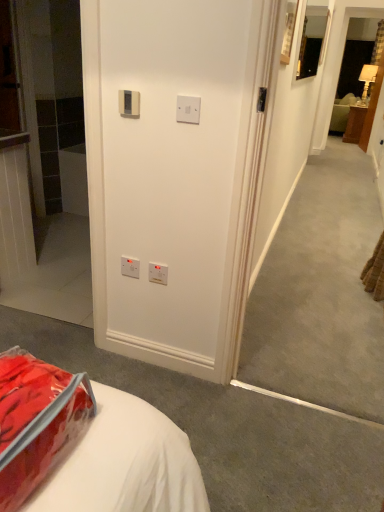
You are a GUI agent. You are given a task and a screenshot of the screen. Output one action in this format:
    pyautogui.click(x=<x>, y=<y>)
    Task: Click on the beige plastic thermostat at upper center, the second electric outlet when ordered from front to back
    
    Given the screenshot: What is the action you would take?
    pyautogui.click(x=129, y=103)

Where is `white plastic electric outlet at center, which appears as the 2th electric outlet when viewed from the right`? white plastic electric outlet at center, which appears as the 2th electric outlet when viewed from the right is located at coordinates click(x=158, y=273).

This screenshot has height=512, width=384. In order to click on wooden nightstand at right in this screenshot , I will do `click(355, 123)`.

What do you see at coordinates (188, 109) in the screenshot?
I see `white plastic switch at upper center, which is the 1th electric outlet from right to left` at bounding box center [188, 109].

Identify the location of beige plastic thermostat at upper center, the third electric outlet when ordered from back to front. (129, 103).

Can you confirm if white plastic electric outlet at lower center, marked as the third electric outlet in a top-to-bottom arrangement, is shorter than white plastic switch at upper center, which is counted as the third electric outlet, starting from the bottom?

No.

Is point (133, 269) closer or farther from the camera than point (182, 96)?

Point (133, 269) is positioned farther from the camera compared to point (182, 96).

Would you say white plastic electric outlet at lower center, acting as the 1th electric outlet starting from the left, is to the left or to the right of white plastic switch at upper center, which ranks as the 4th electric outlet in back-to-front order, in the picture?

Clearly, white plastic electric outlet at lower center, acting as the 1th electric outlet starting from the left, is on the left of white plastic switch at upper center, which ranks as the 4th electric outlet in back-to-front order, in the image.

Does white plastic electric outlet at lower center, marked as the third electric outlet in a top-to-bottom arrangement, contain white plastic switch at upper center, which ranks as the 4th electric outlet in back-to-front order?

That's incorrect, white plastic switch at upper center, which ranks as the 4th electric outlet in back-to-front order, is not inside white plastic electric outlet at lower center, marked as the third electric outlet in a top-to-bottom arrangement.

Looking at this image, from the image's perspective, does white plastic electric outlet at lower center, marked as the third electric outlet in a top-to-bottom arrangement, appear lower than beige plastic thermostat at upper center, which is the 1th electric outlet from top to bottom?

Correct, white plastic electric outlet at lower center, marked as the third electric outlet in a top-to-bottom arrangement, appears lower than beige plastic thermostat at upper center, which is the 1th electric outlet from top to bottom, in the image.

In the scene shown: Is white plastic electric outlet at lower center, the 4th electric outlet in the front-to-back sequence, taller than beige plastic thermostat at upper center, the third electric outlet when ordered from back to front?

Yes.

Looking at this image, can you confirm if white plastic electric outlet at lower center, the 4th electric outlet in the front-to-back sequence, is bigger than beige plastic thermostat at upper center, the second electric outlet when ordered from front to back?

No, white plastic electric outlet at lower center, the 4th electric outlet in the front-to-back sequence, is not bigger than beige plastic thermostat at upper center, the second electric outlet when ordered from front to back.

Could you tell me if white plastic electric outlet at lower center, marked as the third electric outlet in a top-to-bottom arrangement, is turned towards beige plastic thermostat at upper center, the third electric outlet when ordered from back to front?

No, white plastic electric outlet at lower center, marked as the third electric outlet in a top-to-bottom arrangement, is not turned towards beige plastic thermostat at upper center, the third electric outlet when ordered from back to front.

Could you tell me if matte black mirror at upper right is turned towards white plastic electric outlet at lower center, which is the fourth electric outlet from right to left?

No, matte black mirror at upper right is not aimed at white plastic electric outlet at lower center, which is the fourth electric outlet from right to left.

From the image's perspective, which one is positioned higher, matte black mirror at upper right or white plastic electric outlet at lower center, which is the fourth electric outlet from right to left?

matte black mirror at upper right is shown above in the image.

Is matte black mirror at upper right wider or thinner than white plastic electric outlet at lower center, which is the fourth electric outlet from right to left?

Considering their sizes, matte black mirror at upper right looks broader than white plastic electric outlet at lower center, which is the fourth electric outlet from right to left.

Is white plastic electric outlet at center, arranged as the fourth electric outlet when viewed from the top, thinner than translucent plastic bag at lower left?

Indeed, white plastic electric outlet at center, arranged as the fourth electric outlet when viewed from the top, has a lesser width compared to translucent plastic bag at lower left.

You are a GUI agent. You are given a task and a screenshot of the screen. Output one action in this format:
    pyautogui.click(x=<x>, y=<y>)
    Task: Click on the electric outlet that is the 2nd object directly below the translucent plastic bag at lower left (from a real-world perspective)
    This screenshot has height=512, width=384.
    Given the screenshot: What is the action you would take?
    pyautogui.click(x=158, y=273)

From the image's perspective, relative to translucent plastic bag at lower left, is white plastic electric outlet at center, which is the 1th electric outlet from bottom to top, above or below?

From the image's perspective, white plastic electric outlet at center, which is the 1th electric outlet from bottom to top, appears above translucent plastic bag at lower left.

Is white plastic electric outlet at center, arranged as the fourth electric outlet when viewed from the top, aimed at translucent plastic bag at lower left?

Yes, white plastic electric outlet at center, arranged as the fourth electric outlet when viewed from the top, is oriented towards translucent plastic bag at lower left.

From the image's perspective, is white plastic switch at upper center, which is the 1th electric outlet from right to left, located above or below wooden nightstand at right?

white plastic switch at upper center, which is the 1th electric outlet from right to left, is situated lower than wooden nightstand at right in the image.

Considering the sizes of objects white plastic switch at upper center, which ranks as the 4th electric outlet in back-to-front order, and wooden nightstand at right in the image provided, who is shorter, white plastic switch at upper center, which ranks as the 4th electric outlet in back-to-front order, or wooden nightstand at right?

white plastic switch at upper center, which ranks as the 4th electric outlet in back-to-front order.

Considering the relative positions of white plastic switch at upper center, which is counted as the third electric outlet, starting from the bottom, and wooden nightstand at right in the image provided, is white plastic switch at upper center, which is counted as the third electric outlet, starting from the bottom, to the right of wooden nightstand at right from the viewer's perspective?

In fact, white plastic switch at upper center, which is counted as the third electric outlet, starting from the bottom, is to the left of wooden nightstand at right.

Is white plastic switch at upper center, which is the 1th electric outlet from right to left, bigger or smaller than wooden nightstand at right?

Result: Clearly, white plastic switch at upper center, which is the 1th electric outlet from right to left, is smaller in size than wooden nightstand at right.

Considering the relative positions of white plastic electric outlet at center, arranged as the second electric outlet when viewed from the back, and matte black mirror at upper right in the image provided, is white plastic electric outlet at center, arranged as the second electric outlet when viewed from the back, to the left of matte black mirror at upper right from the viewer's perspective?

Yes, white plastic electric outlet at center, arranged as the second electric outlet when viewed from the back, is to the left of matte black mirror at upper right.

Based on the photo, does white plastic electric outlet at center, which appears as the 2th electric outlet when viewed from the right, have a greater height compared to matte black mirror at upper right?

In fact, white plastic electric outlet at center, which appears as the 2th electric outlet when viewed from the right, may be shorter than matte black mirror at upper right.

Locate an element on the screen. picture frame above the white plastic electric outlet at center, arranged as the fourth electric outlet when viewed from the top (from the image's perspective) is located at coordinates (312, 38).

In the scene shown: Between white plastic electric outlet at center, arranged as the fourth electric outlet when viewed from the top, and matte black mirror at upper right, which one is positioned behind?

matte black mirror at upper right is more distant.

Between point (347, 142) and point (150, 265), which one is positioned in front?

The point (150, 265) is more forward.

From the image's perspective, is wooden nightstand at right above or below white plastic electric outlet at center, arranged as the fourth electric outlet when viewed from the top?

wooden nightstand at right is above white plastic electric outlet at center, arranged as the fourth electric outlet when viewed from the top.

Would you say wooden nightstand at right is outside white plastic electric outlet at center, arranged as the second electric outlet when viewed from the back?

Yes, wooden nightstand at right is located beyond the bounds of white plastic electric outlet at center, arranged as the second electric outlet when viewed from the back.

From the image's perspective, starting from the white plastic switch at upper center, which ranks as the 4th electric outlet in back-to-front order, which electric outlet is the 1st one below? Please provide its 2D coordinates.

[(130, 267)]

I want to click on the 1st electric outlet located above the white plastic electric outlet at lower center, marked as the third electric outlet in a top-to-bottom arrangement (from a real-world perspective), so click(129, 103).

Considering their positions, is white plastic switch at upper center, which is the 1th electric outlet from right to left, positioned closer to matte black mirror at upper right than white plastic electric outlet at center, which appears as the 2th electric outlet when viewed from the right?

The object closer to matte black mirror at upper right is white plastic switch at upper center, which is the 1th electric outlet from right to left.

Looking at this image, considering their positions, is white plastic electric outlet at center, which is counted as the third electric outlet, starting from the left, positioned further to translucent plastic bag at lower left than beige plastic thermostat at upper center, the second electric outlet when ordered from front to back?

Among the two, beige plastic thermostat at upper center, the second electric outlet when ordered from front to back, is located further to translucent plastic bag at lower left.

Based on their spatial positions, is translucent plastic bag at lower left or wooden nightstand at right closer to beige plastic thermostat at upper center, the second electric outlet when ordered from front to back?

Among the two, translucent plastic bag at lower left is located nearer to beige plastic thermostat at upper center, the second electric outlet when ordered from front to back.

Estimate the real-world distances between objects in this image. Which object is closer to wooden nightstand at right, white plastic switch at upper center, which is counted as the third electric outlet, starting from the bottom, or matte black mirror at upper right?

Based on the image, matte black mirror at upper right appears to be nearer to wooden nightstand at right.

Estimate the real-world distances between objects in this image. Which object is closer to translucent plastic bag at lower left, wooden nightstand at right or white plastic switch at upper center, which is counted as the third electric outlet, starting from the bottom?

white plastic switch at upper center, which is counted as the third electric outlet, starting from the bottom, lies closer to translucent plastic bag at lower left than the other object.

Looking at the image, which one is located closer to translucent plastic bag at lower left, white plastic switch at upper center, the fourth electric outlet from the left, or matte black mirror at upper right?

Among the two, white plastic switch at upper center, the fourth electric outlet from the left, is located nearer to translucent plastic bag at lower left.

Based on their spatial positions, is matte black mirror at upper right or beige plastic thermostat at upper center, which is the 1th electric outlet from top to bottom, further from wooden nightstand at right?

beige plastic thermostat at upper center, which is the 1th electric outlet from top to bottom, is further to wooden nightstand at right.

From the picture: From the image, which object appears to be farther from white plastic electric outlet at center, which appears as the 2th electric outlet when viewed from the right, beige plastic thermostat at upper center, the third electric outlet when ordered from back to front, or white plastic electric outlet at lower center, acting as the 1th electric outlet starting from the left?

beige plastic thermostat at upper center, the third electric outlet when ordered from back to front, is further to white plastic electric outlet at center, which appears as the 2th electric outlet when viewed from the right.

Image resolution: width=384 pixels, height=512 pixels. Identify the location of electric outlet located between translucent plastic bag at lower left and beige plastic thermostat at upper center, the 4th electric outlet from the bottom, in the depth direction. (188, 109).

The width and height of the screenshot is (384, 512). I want to click on picture frame between white plastic switch at upper center, which is the 1th electric outlet from right to left, and wooden nightstand at right, along the z-axis, so click(312, 38).

At what (x,y) coordinates should I click in order to perform the action: click on electric outlet between white plastic switch at upper center, which appears as the 2th electric outlet when viewed from the top, and white plastic electric outlet at center, positioned as the third electric outlet in front-to-back order, in the up-down direction. Please return your answer as a coordinate pair (x, y). This screenshot has height=512, width=384. Looking at the image, I should click on (130, 267).

Image resolution: width=384 pixels, height=512 pixels. In order to click on picture frame positioned between white plastic electric outlet at center, positioned as the third electric outlet in front-to-back order, and wooden nightstand at right from near to far in this screenshot , I will do click(x=312, y=38).